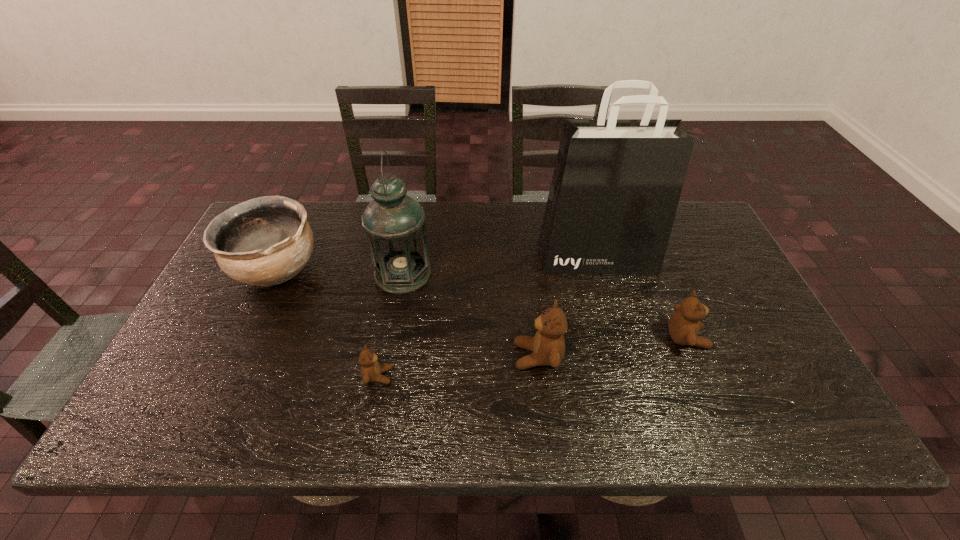
This screenshot has width=960, height=540. I want to click on free space located 0.280m at the face of the second teddy bear from left to right, so click(x=398, y=356).

Find the location of a particular element. The width and height of the screenshot is (960, 540). free space located at the face of the second teddy bear from left to right is located at coordinates (465, 356).

Where is `free space located 0.110m at the face of the second tallest teddy bear`? free space located 0.110m at the face of the second tallest teddy bear is located at coordinates (750, 338).

Where is `blank space located on the front of the fifth shortest object`? The height and width of the screenshot is (540, 960). blank space located on the front of the fifth shortest object is located at coordinates point(396,312).

Identify the location of vacant region located 0.210m on the front with handles of the tallest object. Image resolution: width=960 pixels, height=540 pixels. (618, 332).

In order to click on vacant space located 0.330m on the right of the pottery in this screenshot , I will do `click(434, 269)`.

This screenshot has height=540, width=960. I want to click on shopping bag located in the far edge section of the desktop, so click(616, 185).

Find the location of a particular element. The height and width of the screenshot is (540, 960). pottery at the far edge is located at coordinates point(265,241).

This screenshot has width=960, height=540. What are the coordinates of `object at the left edge` in the screenshot? It's located at click(265, 241).

Locate an element on the screen. Image resolution: width=960 pixels, height=540 pixels. object present at the far left corner is located at coordinates (265, 241).